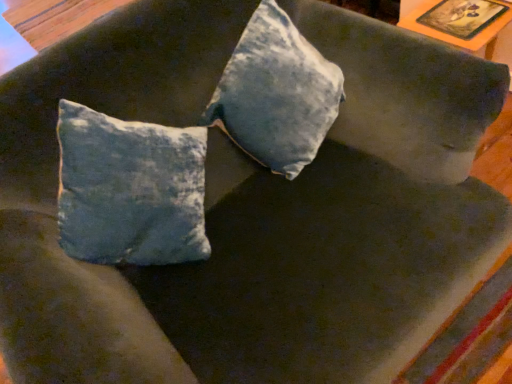
Find the location of a particular element. The image size is (512, 384). free space below wooden table at upper right (from a real-world perspective) is located at coordinates (457, 10).